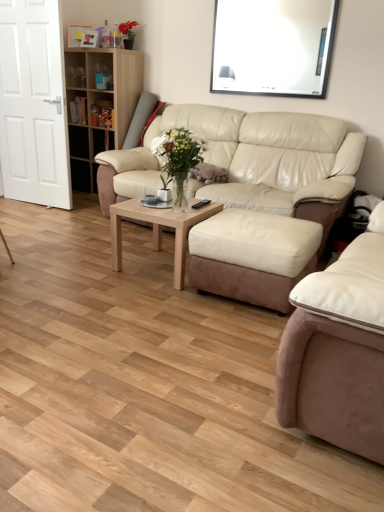
Question: Is wooden bookshelf at upper left beside white glossy door at left?

Choices:
 (A) no
 (B) yes

Answer: (A)

Question: Considering the relative positions of wooden bookshelf at upper left and white glossy door at left in the image provided, is wooden bookshelf at upper left in front of white glossy door at left?

Choices:
 (A) no
 (B) yes

Answer: (A)

Question: Is wooden bookshelf at upper left positioned far away from white glossy door at left?

Choices:
 (A) yes
 (B) no

Answer: (B)

Question: Can you confirm if wooden bookshelf at upper left is taller than white glossy door at left?

Choices:
 (A) no
 (B) yes

Answer: (A)

Question: Is wooden bookshelf at upper left outside white glossy door at left?

Choices:
 (A) yes
 (B) no

Answer: (A)

Question: From a real-world perspective, is white glossy window screen at upper center above or below beige leather couch at center, the second studio couch viewed from the back?

Choices:
 (A) below
 (B) above

Answer: (B)

Question: Considering the positions of white glossy window screen at upper center and beige leather couch at center, the second studio couch viewed from the back, in the image, is white glossy window screen at upper center wider or thinner than beige leather couch at center, the second studio couch viewed from the back,?

Choices:
 (A) wide
 (B) thin

Answer: (B)

Question: Considering the positions of white glossy window screen at upper center and beige leather couch at center, which is the first studio couch in front-to-back order, in the image, is white glossy window screen at upper center bigger or smaller than beige leather couch at center, which is the first studio couch in front-to-back order,?

Choices:
 (A) small
 (B) big

Answer: (A)

Question: Visually, is white glossy window screen at upper center positioned to the left or to the right of beige leather couch at center, which is the first studio couch in front-to-back order?

Choices:
 (A) right
 (B) left

Answer: (B)

Question: Considering the positions of wooden bookshelf at upper left and white glossy window screen at upper center in the image, is wooden bookshelf at upper left taller or shorter than white glossy window screen at upper center?

Choices:
 (A) tall
 (B) short

Answer: (A)

Question: Relative to white glossy window screen at upper center, is wooden bookshelf at upper left in front or behind?

Choices:
 (A) behind
 (B) front

Answer: (A)

Question: Do you think wooden bookshelf at upper left is within white glossy window screen at upper center, or outside of it?

Choices:
 (A) outside
 (B) inside

Answer: (A)

Question: From the image's perspective, is wooden bookshelf at upper left positioned above or below white glossy window screen at upper center?

Choices:
 (A) below
 (B) above

Answer: (A)

Question: Is beige leather couch at center, the second studio couch viewed from the back, to the left or to the right of wooden bookshelf at upper left in the image?

Choices:
 (A) left
 (B) right

Answer: (B)

Question: From a real-world perspective, is beige leather couch at center, which is the first studio couch in front-to-back order, positioned above or below wooden bookshelf at upper left?

Choices:
 (A) below
 (B) above

Answer: (A)